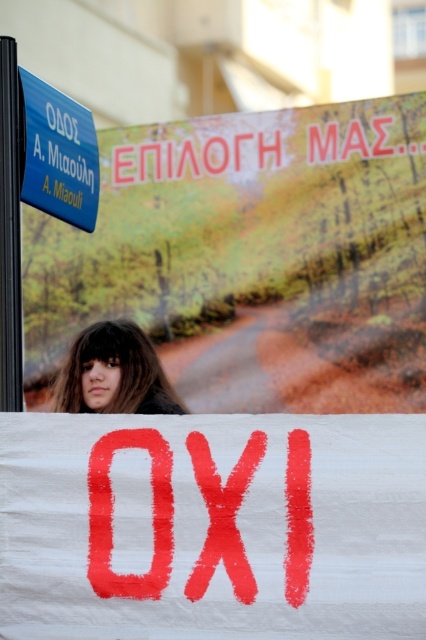
Question: Which object is farther from the camera taking this photo?

Choices:
 (A) brown hair at center
 (B) red painted sign at center
 (C) blue plastic sign at upper left

Answer: (A)

Question: Which of the following is the closest to the observer?

Choices:
 (A) (276, 632)
 (B) (62, 380)
 (C) (161, 340)
 (D) (26, 80)

Answer: (A)

Question: Is red painted sign at center thinner than brown hair at center?

Choices:
 (A) no
 (B) yes

Answer: (A)

Question: Which point appears closest to the camera in this image?

Choices:
 (A) (45, 179)
 (B) (166, 392)
 (C) (336, 198)
 (D) (68, 563)

Answer: (D)

Question: Is white paper banner at upper center to the left of blue plastic sign at upper left from the viewer's perspective?

Choices:
 (A) no
 (B) yes

Answer: (A)

Question: Is red painted sign at center bigger than blue plastic sign at upper left?

Choices:
 (A) no
 (B) yes

Answer: (B)